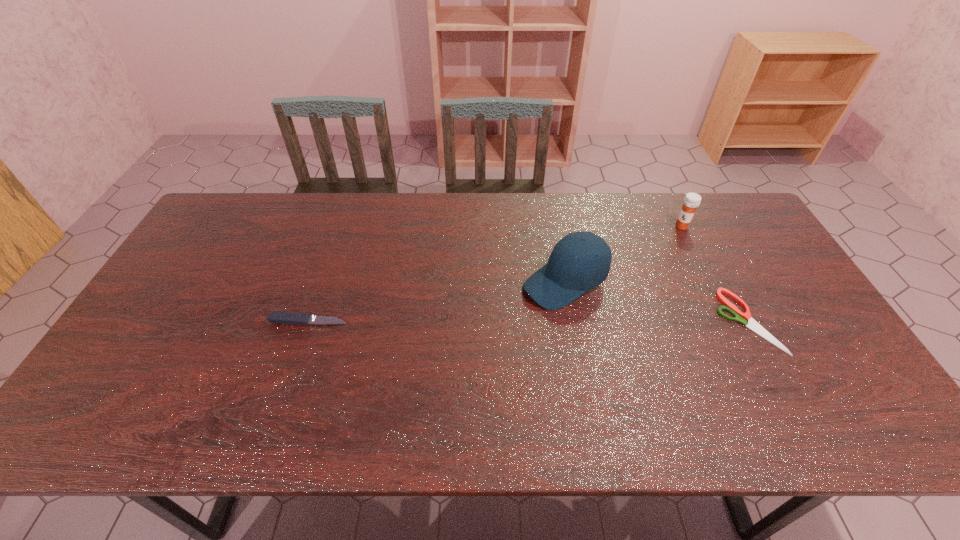
Locate an element on the screen. The image size is (960, 540). steak knife is located at coordinates (287, 318).

This screenshot has width=960, height=540. In order to click on the leftmost object in this screenshot , I will do `click(287, 318)`.

Locate an element on the screen. This screenshot has width=960, height=540. scissors is located at coordinates (742, 318).

In order to click on baseball cap in this screenshot , I will do `click(580, 261)`.

Locate an element on the screen. Image resolution: width=960 pixels, height=540 pixels. the third object from right to left is located at coordinates (580, 261).

Where is `the farthest object`? The image size is (960, 540). the farthest object is located at coordinates (692, 200).

Where is `medicine`? Image resolution: width=960 pixels, height=540 pixels. medicine is located at coordinates (692, 200).

This screenshot has width=960, height=540. Find the location of `free spot located 0.200m on the left of the steak knife`. free spot located 0.200m on the left of the steak knife is located at coordinates (195, 321).

The width and height of the screenshot is (960, 540). Find the location of `vacant space situated on the back of the shortest object`. vacant space situated on the back of the shortest object is located at coordinates pyautogui.click(x=689, y=213).

You are a GUI agent. You are given a task and a screenshot of the screen. Output one action in this format:
    pyautogui.click(x=<x>, y=<y>)
    Task: Click on the free space located 0.390m on the front-facing side of the tallest object
    The width and height of the screenshot is (960, 540).
    Given the screenshot: What is the action you would take?
    pyautogui.click(x=405, y=359)